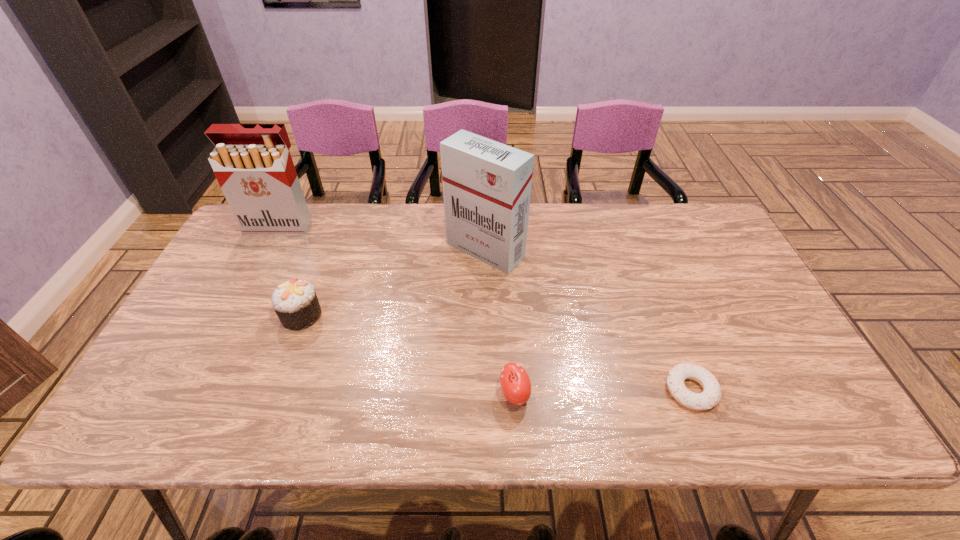
Identify the location of free space located on the left of the second shortest object. (337, 394).

Locate an element on the screen. Image resolution: width=960 pixels, height=540 pixels. free spot located on the left of the shortest object is located at coordinates (626, 390).

This screenshot has height=540, width=960. Identify the location of apple positioned at the near edge. (515, 383).

What are the coordinates of `doughnut present at the near edge` in the screenshot? It's located at click(x=711, y=395).

The height and width of the screenshot is (540, 960). What are the coordinates of `object that is at the left edge` in the screenshot? It's located at (252, 163).

The height and width of the screenshot is (540, 960). In order to click on object positioned at the far left corner in this screenshot , I will do `click(252, 163)`.

Where is `blank space at the far edge of the desktop`? The width and height of the screenshot is (960, 540). blank space at the far edge of the desktop is located at coordinates (537, 228).

The height and width of the screenshot is (540, 960). Identify the location of vacant space at the near edge of the desktop. click(x=578, y=403).

Find the location of a particular element. The width and height of the screenshot is (960, 540). vacant space at the left edge of the desktop is located at coordinates point(203,308).

You are a GUI agent. You are given a task and a screenshot of the screen. Output one action in this format:
    pyautogui.click(x=<x>, y=<y>)
    Task: Click on the free space at the right edge
    This screenshot has height=540, width=960.
    Given the screenshot: What is the action you would take?
    pyautogui.click(x=768, y=353)